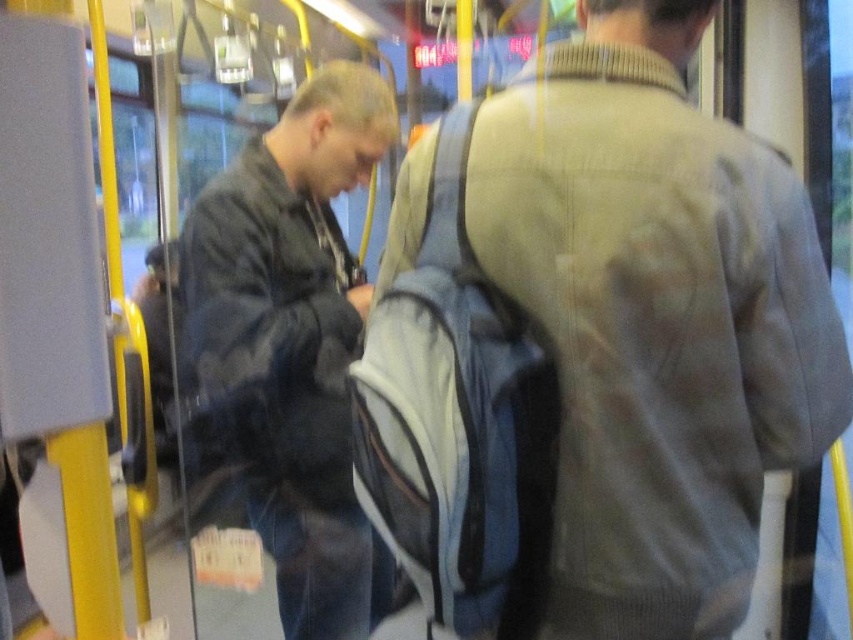
Question: Is black matte jacket at left below gray wool sweater at center?

Choices:
 (A) yes
 (B) no

Answer: (A)

Question: Which point is closer to the camera?

Choices:
 (A) black matte jacket at left
 (B) gray wool sweater at center

Answer: (B)

Question: Where is black matte jacket at left located in relation to gray wool sweater at center in the image?

Choices:
 (A) left
 (B) right

Answer: (A)

Question: Which of the following is the farthest from the observer?

Choices:
 (A) gray wool sweater at center
 (B) black matte jacket at left

Answer: (B)

Question: From the image, what is the correct spatial relationship of black matte jacket at left in relation to gray wool sweater at center?

Choices:
 (A) above
 (B) below

Answer: (B)

Question: Which point is closer to the camera?

Choices:
 (A) (544, 209)
 (B) (273, 417)

Answer: (A)